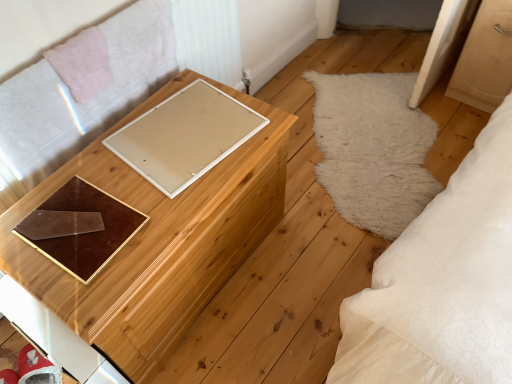
Question: Does wooden chest at center have a smaller size compared to brown glossy tray at center?

Choices:
 (A) no
 (B) yes

Answer: (A)

Question: Is wooden chest at center bigger than brown glossy tray at center?

Choices:
 (A) no
 (B) yes

Answer: (B)

Question: Is wooden chest at center at the left side of brown glossy tray at center?

Choices:
 (A) no
 (B) yes

Answer: (A)

Question: Considering the relative positions of wooden chest at center and brown glossy tray at center in the image provided, is wooden chest at center behind brown glossy tray at center?

Choices:
 (A) no
 (B) yes

Answer: (A)

Question: From the image's perspective, is wooden chest at center on top of brown glossy tray at center?

Choices:
 (A) yes
 (B) no

Answer: (B)

Question: Considering the relative positions of wooden chest at center and brown glossy tray at center in the image provided, is wooden chest at center to the right of brown glossy tray at center from the viewer's perspective?

Choices:
 (A) no
 (B) yes

Answer: (B)

Question: Is brown glossy tray at center to the right of wooden chest at center from the viewer's perspective?

Choices:
 (A) yes
 (B) no

Answer: (B)

Question: From the image's perspective, does brown glossy tray at center appear lower than wooden chest at center?

Choices:
 (A) no
 (B) yes

Answer: (A)

Question: Can you confirm if brown glossy tray at center is smaller than wooden chest at center?

Choices:
 (A) no
 (B) yes

Answer: (B)

Question: Is brown glossy tray at center beside wooden chest at center?

Choices:
 (A) no
 (B) yes

Answer: (A)

Question: From the image's perspective, does brown glossy tray at center appear higher than wooden chest at center?

Choices:
 (A) no
 (B) yes

Answer: (B)

Question: Is brown glossy tray at center in front of wooden chest at center?

Choices:
 (A) no
 (B) yes

Answer: (A)

Question: From the image's perspective, would you say beige matte board at center is positioned over wooden chest at center?

Choices:
 (A) yes
 (B) no

Answer: (A)